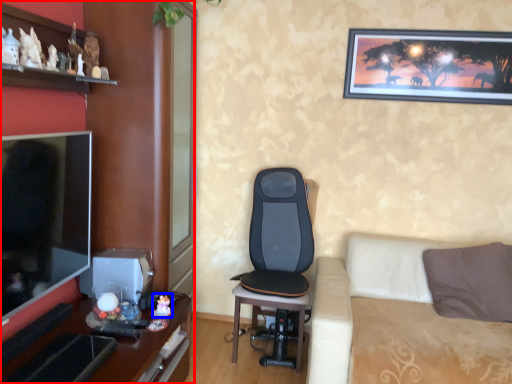
Question: Which of the following is the closest to the observer, entertainment center (highlighted by a red box) or toy (highlighted by a blue box)?

Choices:
 (A) entertainment center
 (B) toy

Answer: (A)